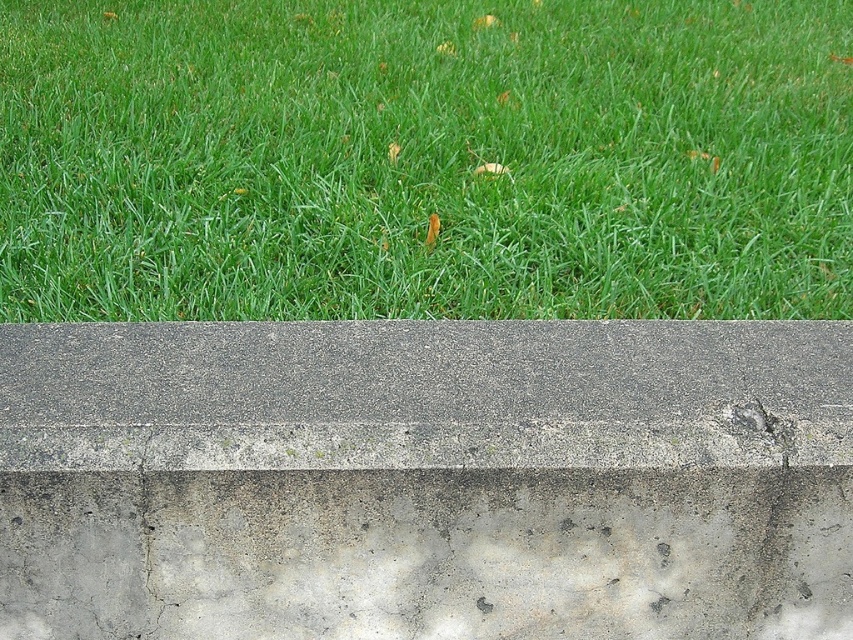
Question: Which object is positioned closest to the green grass at upper?

Choices:
 (A) gray concrete bench at bottom
 (B) gray concrete at center

Answer: (A)

Question: Which point appears closest to the camera in this image?

Choices:
 (A) (498, 358)
 (B) (216, 417)

Answer: (B)

Question: Which point is closer to the camera?

Choices:
 (A) gray concrete bench at bottom
 (B) green grass at upper
 (C) gray concrete at center

Answer: (C)

Question: Does green grass at upper have a smaller size compared to gray concrete at center?

Choices:
 (A) no
 (B) yes

Answer: (A)

Question: Is green grass at upper bigger than gray concrete bench at bottom?

Choices:
 (A) yes
 (B) no

Answer: (A)

Question: Is gray concrete bench at bottom to the right of gray concrete at center from the viewer's perspective?

Choices:
 (A) no
 (B) yes

Answer: (A)